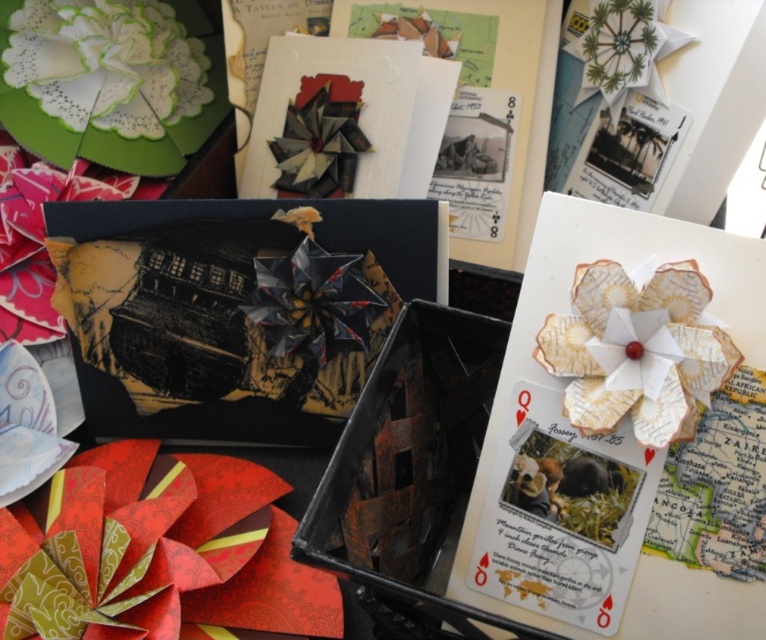
Between point (251, 589) and point (174, 54), which one is positioned in front?

Positioned in front is point (251, 589).

Can you confirm if red paper flower at lower left is positioned to the right of white paper flower at upper left?

Yes, red paper flower at lower left is to the right of white paper flower at upper left.

What do you see at coordinates (159, 554) in the screenshot?
I see `red paper flower at lower left` at bounding box center [159, 554].

This screenshot has width=766, height=640. Find the location of `red paper flower at lower left`. red paper flower at lower left is located at coordinates (159, 554).

Is point (509, 560) in front of point (175, 54)?

Yes.

Looking at this image, can you confirm if white paper postcard at center is wider than white paper flower at upper left?

No, white paper postcard at center is not wider than white paper flower at upper left.

This screenshot has height=640, width=766. I want to click on white paper postcard at center, so click(562, 515).

This screenshot has width=766, height=640. Describe the element at coordinates (624, 435) in the screenshot. I see `map paper flower at upper right` at that location.

Who is lower down, map paper flower at upper right or red paper flower at lower left?

red paper flower at lower left is below.

The height and width of the screenshot is (640, 766). Identify the location of map paper flower at upper right. (624, 435).